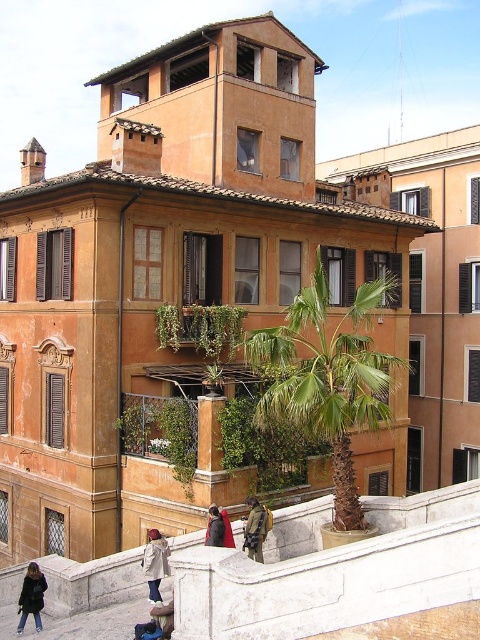
You are standing at the white stone railing in front of the building. You notice two points marked in the scene. The first point is at coordinates point (289, 307), and the second is at point (186, 332). Which of these points is closer to you?

Point (186, 332) is closer to you because it is in front of point (289, 307).

You are standing in front of the building and see the green leafy plants at center and the denim jacket at lower center. Which object takes up more visual space in the image?

The green leafy plants at center takes up more visual space in the image compared to the denim jacket at lower center because it has a larger size.